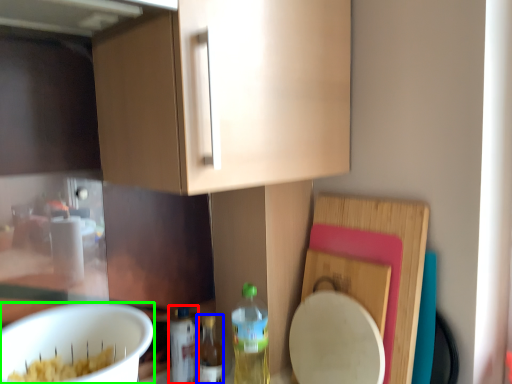
Question: Which object is positioned farthest from bottle (highlighted by a red box)? Select from bottle (highlighted by a blue box) and mixing bowl (highlighted by a green box).

Choices:
 (A) bottle
 (B) mixing bowl

Answer: (B)